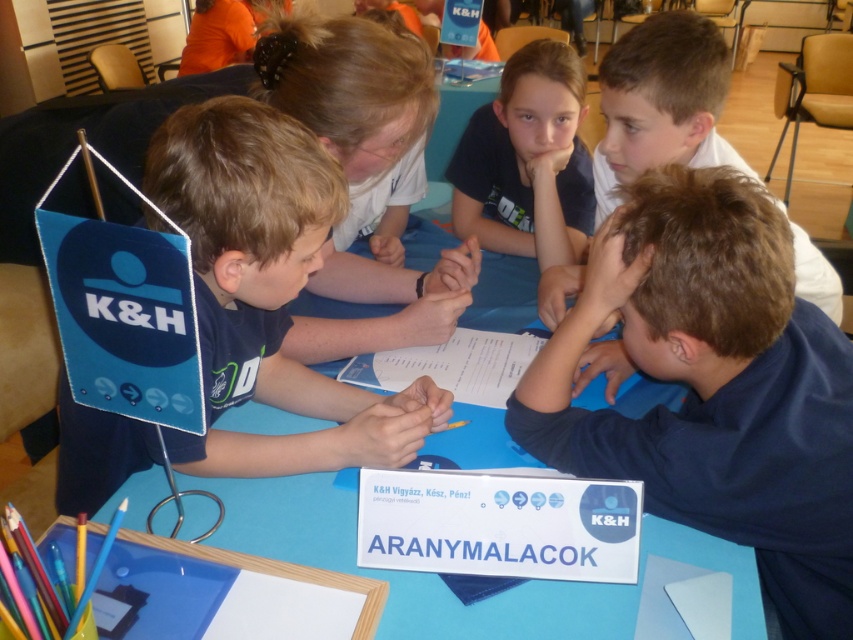
You are a photographer standing in front of the table where the children are working. You want to take a photo that includes both the matte blue sign at left and the dark blue shirt at upper right. Which object should you position closer to the camera to ensure both are in focus?

The matte blue sign at left is much taller than the dark blue shirt at upper right. To ensure both are in focus, position the matte blue sign at left closer to the camera since it is larger and requires more detail.

You are standing at the center of the image. Which direction should you move to reach the matte blue sign at left?

You should move to the left to reach the matte blue sign at left since it is located at the left side of the image.